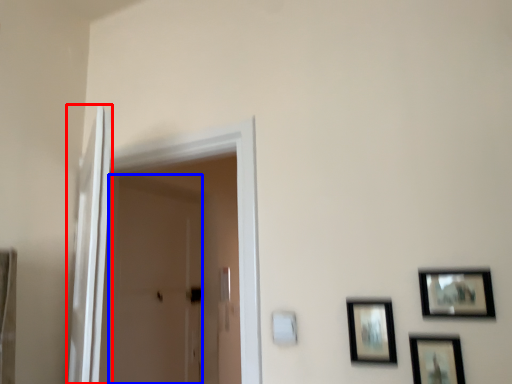
Question: Which object is closer to the camera taking this photo, screen door (highlighted by a red box) or screen door (highlighted by a blue box)?

Choices:
 (A) screen door
 (B) screen door

Answer: (A)